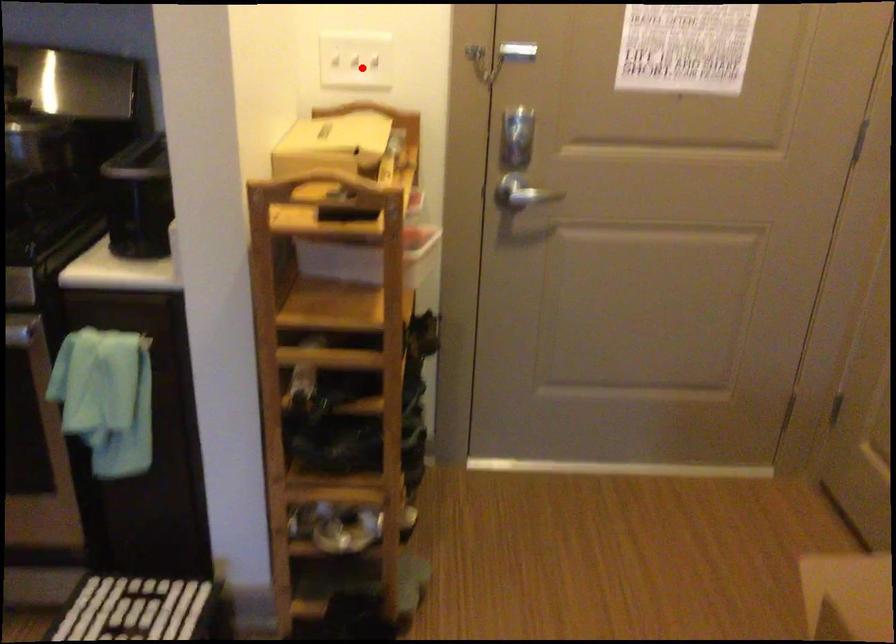
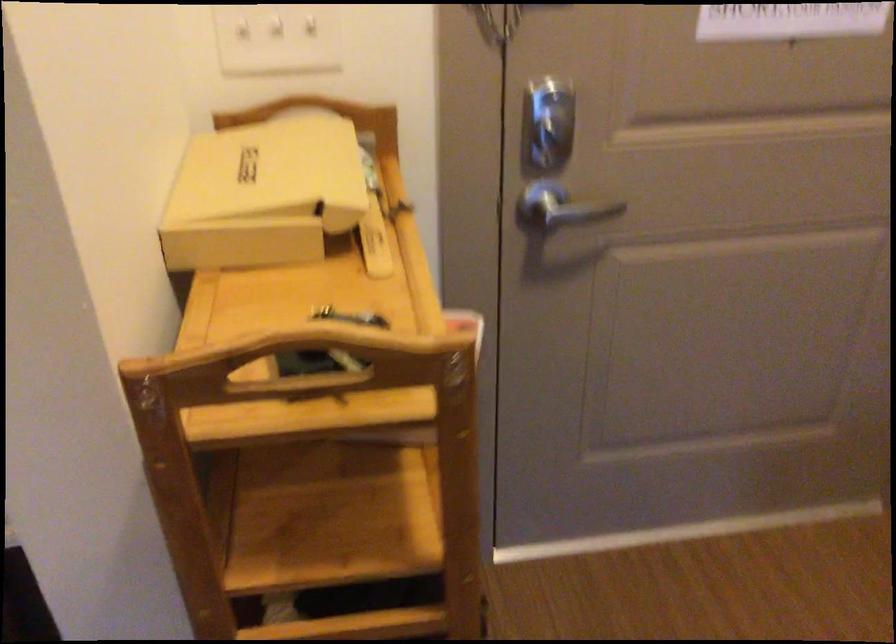
Question: I am providing you with two images of the same scene from different viewpoints. In image1, a red point is highlighted. Considering the same 3D point in image2, which of the following is correct?

Choices:
 (A) It is closer
 (B) It is farther

Answer: (A)